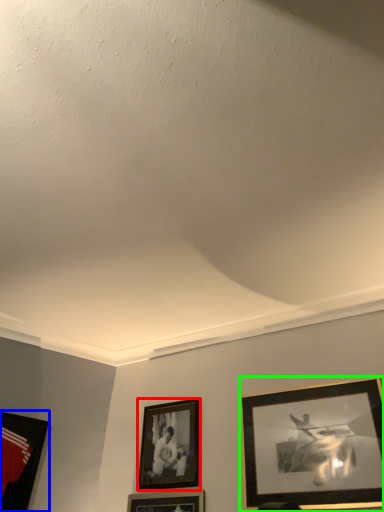
Question: Considering the real-world distances, which object is farthest from picture frame (highlighted by a red box)? picture frame (highlighted by a blue box) or picture frame (highlighted by a green box)?

Choices:
 (A) picture frame
 (B) picture frame

Answer: (A)